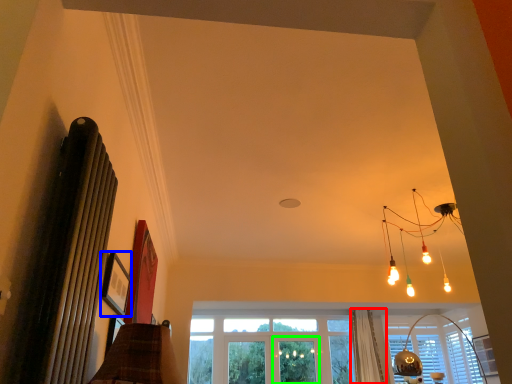
Question: Which is nearer to the curtain (highlighted by a red box)? picture frame (highlighted by a blue box) or screen door (highlighted by a green box).

Choices:
 (A) picture frame
 (B) screen door

Answer: (B)